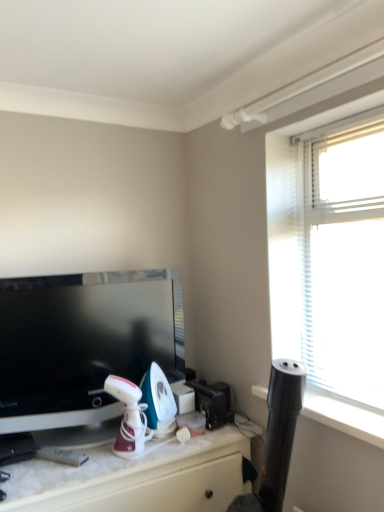
Question: From the image's perspective, is white marble desk at lower center located above or below black glossy television at left?

Choices:
 (A) above
 (B) below

Answer: (B)

Question: In the image, is white marble desk at lower center on the left side or the right side of black glossy television at left?

Choices:
 (A) left
 (B) right

Answer: (B)

Question: From a real-world perspective, is white marble desk at lower center physically located above or below black glossy television at left?

Choices:
 (A) below
 (B) above

Answer: (A)

Question: Considering the positions of point click(54, 356) and point click(188, 465), is point click(54, 356) closer or farther from the camera than point click(188, 465)?

Choices:
 (A) farther
 (B) closer

Answer: (A)

Question: From a real-world perspective, is black glossy television at left above or below white marble desk at lower center?

Choices:
 (A) below
 (B) above

Answer: (B)

Question: Considering the positions of black glossy television at left and white marble desk at lower center in the image, is black glossy television at left wider or thinner than white marble desk at lower center?

Choices:
 (A) wide
 (B) thin

Answer: (B)

Question: In terms of size, does black glossy television at left appear bigger or smaller than white marble desk at lower center?

Choices:
 (A) big
 (B) small

Answer: (B)